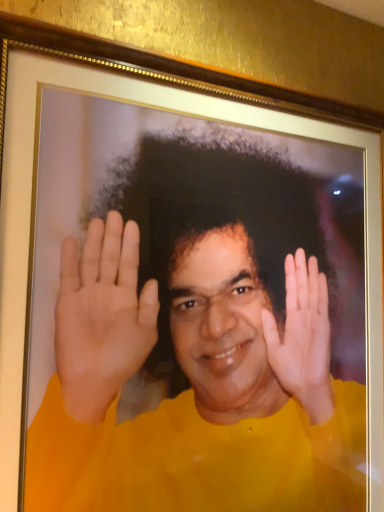
What do you see at coordinates (198, 345) in the screenshot?
I see `yellow matte shirt at center` at bounding box center [198, 345].

Find the location of `yellow matte shirt at center`. yellow matte shirt at center is located at coordinates (198, 345).

This screenshot has width=384, height=512. Identify the location of yellow matte shirt at center. (198, 345).